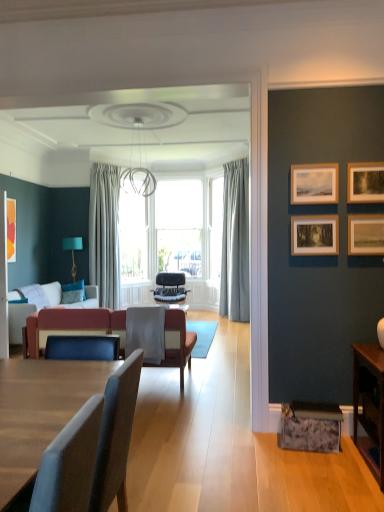
Question: From the image's perspective, is velvet red couch at center on wooden table at lower right?

Choices:
 (A) no
 (B) yes

Answer: (B)

Question: From the image's perspective, is velvet red couch at center below wooden table at lower right?

Choices:
 (A) yes
 (B) no

Answer: (B)

Question: Is the position of velvet red couch at center more distant than that of wooden table at lower right?

Choices:
 (A) no
 (B) yes

Answer: (B)

Question: From a real-world perspective, is velvet red couch at center located higher than wooden table at lower right?

Choices:
 (A) yes
 (B) no

Answer: (A)

Question: Can we say velvet red couch at center lies outside wooden table at lower right?

Choices:
 (A) yes
 (B) no

Answer: (A)

Question: From their relative heights in the image, would you say light gray sheer curtain at center, which is the 2th curtain in right-to-left order, is taller or shorter than black leather chair at center, the 1th chair positioned from the back?

Choices:
 (A) tall
 (B) short

Answer: (A)

Question: In terms of width, does light gray sheer curtain at center, which is the 2th curtain in right-to-left order, look wider or thinner when compared to black leather chair at center, the 1th chair positioned from the back?

Choices:
 (A) wide
 (B) thin

Answer: (B)

Question: In the image, is light gray sheer curtain at center, which is the 2th curtain in right-to-left order, positioned in front of or behind black leather chair at center, the 1th chair positioned from the back?

Choices:
 (A) behind
 (B) front

Answer: (B)

Question: Is light gray sheer curtain at center, which is the 2th curtain in right-to-left order, to the left or to the right of black leather chair at center, the 1th chair positioned from the back, in the image?

Choices:
 (A) right
 (B) left

Answer: (B)

Question: Considering the positions of black leather chair at center, the 1th chair positioned from the back, and teal fabric lampshade at left in the image, is black leather chair at center, the 1th chair positioned from the back, taller or shorter than teal fabric lampshade at left?

Choices:
 (A) short
 (B) tall

Answer: (A)

Question: Looking at their shapes, would you say black leather chair at center, the 2th chair from the front, is wider or thinner than teal fabric lampshade at left?

Choices:
 (A) wide
 (B) thin

Answer: (A)

Question: From the image's perspective, is black leather chair at center, the 1th chair positioned from the back, located above or below teal fabric lampshade at left?

Choices:
 (A) above
 (B) below

Answer: (B)

Question: Is point (165, 282) closer or farther from the camera than point (77, 243)?

Choices:
 (A) farther
 (B) closer

Answer: (B)

Question: Is point (306, 231) closer or farther from the camera than point (157, 281)?

Choices:
 (A) closer
 (B) farther

Answer: (A)

Question: Is wooden picture frame at upper right, the second picture frame when ordered from left to right, bigger or smaller than black leather chair at center, the 1th chair positioned from the back?

Choices:
 (A) small
 (B) big

Answer: (A)